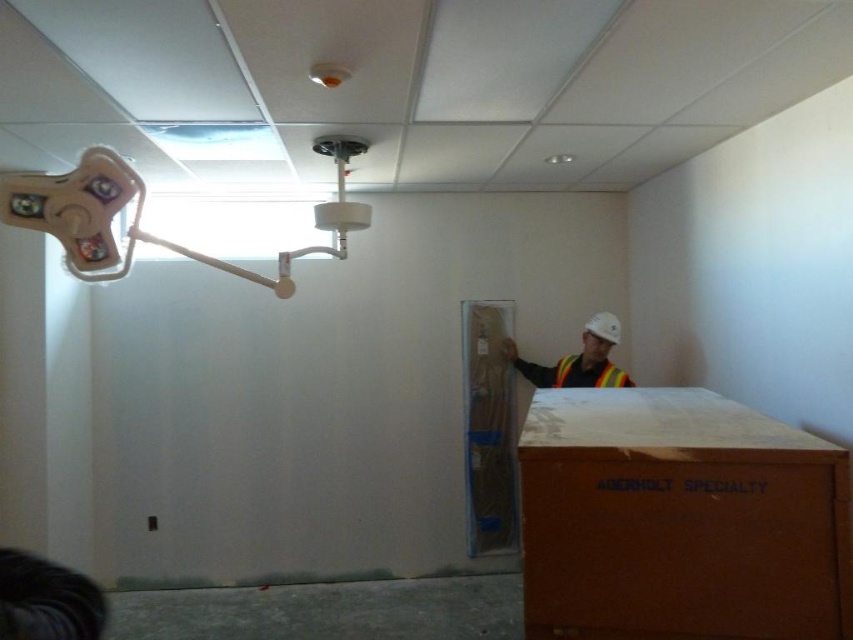
You are standing in a construction area and see a point marked at coordinates (x=679, y=520). What object is located at that point?

The point at coordinates (x=679, y=520) marks the brown cardboard box at lower right.